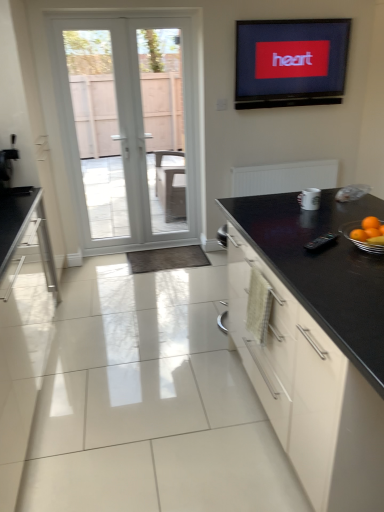
Question: Is black plastic remote control at center, the second appliance viewed from the back, at the right side of white glass door at left?

Choices:
 (A) no
 (B) yes

Answer: (B)

Question: Is black plastic remote control at center, which is the 2th appliance in top-to-bottom order, shorter than white glass door at left?

Choices:
 (A) no
 (B) yes

Answer: (B)

Question: Can you confirm if black plastic remote control at center, the first appliance positioned from the front, is wider than white glass door at left?

Choices:
 (A) yes
 (B) no

Answer: (A)

Question: From the image's perspective, would you say black plastic remote control at center, which is the 2th appliance in top-to-bottom order, is positioned over white glass door at left?

Choices:
 (A) no
 (B) yes

Answer: (A)

Question: Considering the relative sizes of black plastic remote control at center, the second appliance viewed from the back, and white glass door at left in the image provided, is black plastic remote control at center, the second appliance viewed from the back, bigger than white glass door at left?

Choices:
 (A) yes
 (B) no

Answer: (B)

Question: Could you tell me if black plastic remote control at center, the second appliance viewed from the back, is facing white glass door at left?

Choices:
 (A) no
 (B) yes

Answer: (A)

Question: Considering the relative sizes of orange matte at right and white glass door at left in the image provided, is orange matte at right thinner than white glass door at left?

Choices:
 (A) yes
 (B) no

Answer: (B)

Question: From a real-world perspective, is orange matte at right located higher than white glass door at left?

Choices:
 (A) no
 (B) yes

Answer: (A)

Question: Can you confirm if orange matte at right is positioned to the left of white glass door at left?

Choices:
 (A) yes
 (B) no

Answer: (B)

Question: Is orange matte at right looking in the opposite direction of white glass door at left?

Choices:
 (A) no
 (B) yes

Answer: (A)

Question: Does orange matte at right come in front of white glass door at left?

Choices:
 (A) no
 (B) yes

Answer: (B)

Question: Can you confirm if orange matte at right is taller than white glass door at left?

Choices:
 (A) no
 (B) yes

Answer: (A)

Question: From a real-world perspective, is flat screen tv at upper center positioned under white ceramic mug at upper right, which is the 2th appliance in bottom-to-top order, based on gravity?

Choices:
 (A) yes
 (B) no

Answer: (B)